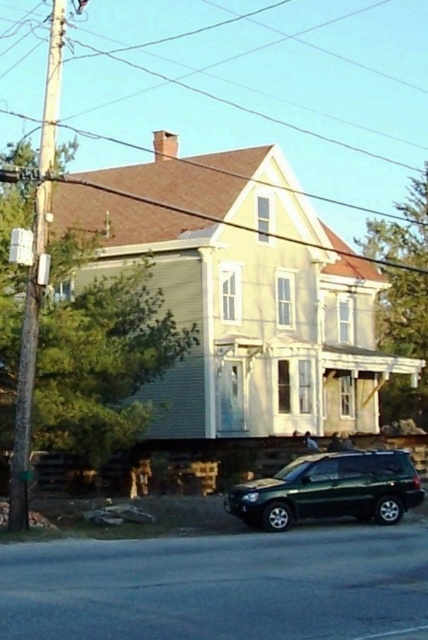
You are standing on the sidewalk in front of the house and see the shiny dark green suv at lower right and the brown wooden pole at left. Which object is closer to the street?

The shiny dark green suv at lower right is closer to the street because it is positioned to the right of the brown wooden pole at left, which is further away from the street.

You are a delivery person approaching the house and need to park your vehicle near the shiny dark green suv at lower right. From the street, can you see the brown wooden pole at left while parking?

The brown wooden pole at left is behind the shiny dark green suv at lower right, so it would be obstructed from view when parking near the suv. You would not be able to see the pole while parking there.